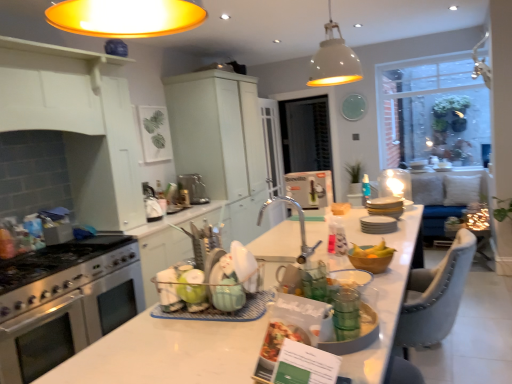
Question: Should I look upward or downward to see clear glass window screen at center, which appears as the first window screen when viewed from the left?

Choices:
 (A) down
 (B) up

Answer: (B)

Question: Is white matte pendant lamp at upper center not near satin nickel kettle at center, marked as the 2th appliance in a front-to-back arrangement?

Choices:
 (A) no
 (B) yes

Answer: (B)

Question: Does white matte pendant lamp at upper center appear on the right side of satin nickel kettle at center, marked as the 2th appliance in a front-to-back arrangement?

Choices:
 (A) yes
 (B) no

Answer: (A)

Question: Can you confirm if white matte pendant lamp at upper center is bigger than satin nickel kettle at center, positioned as the second appliance in right-to-left order?

Choices:
 (A) no
 (B) yes

Answer: (B)

Question: From a real-world perspective, is white matte pendant lamp at upper center over satin nickel kettle at center, marked as the 2th appliance in a front-to-back arrangement?

Choices:
 (A) no
 (B) yes

Answer: (B)

Question: Is white matte pendant lamp at upper center next to satin nickel kettle at center, positioned as the second appliance in right-to-left order, and touching it?

Choices:
 (A) yes
 (B) no

Answer: (B)

Question: Is satin nickel kettle at center, positioned as the second appliance in right-to-left order, located within white matte pendant lamp at upper center?

Choices:
 (A) no
 (B) yes

Answer: (A)

Question: Can you confirm if stainless steel oven at left is wider than green glass cups at center, which appears as the second tableware when viewed from the back?

Choices:
 (A) no
 (B) yes

Answer: (B)

Question: Is stainless steel oven at left positioned behind green glass cups at center, which is the 2th tableware from right to left?

Choices:
 (A) no
 (B) yes

Answer: (B)

Question: Is stainless steel oven at left facing away from green glass cups at center, which is the first tableware from bottom to top?

Choices:
 (A) no
 (B) yes

Answer: (A)

Question: From a real-world perspective, is stainless steel oven at left under green glass cups at center, the 1th tableware from the front?

Choices:
 (A) no
 (B) yes

Answer: (B)

Question: Can you confirm if stainless steel oven at left is positioned to the right of green glass cups at center, which appears as the second tableware when viewed from the back?

Choices:
 (A) yes
 (B) no

Answer: (B)

Question: Is stainless steel oven at left beside green glass cups at center, which is the first tableware from bottom to top?

Choices:
 (A) no
 (B) yes

Answer: (A)

Question: Is clear glass window at upper right, the 2th window screen in the back-to-front sequence, aimed at blue plastic spray bottle at center?

Choices:
 (A) yes
 (B) no

Answer: (A)